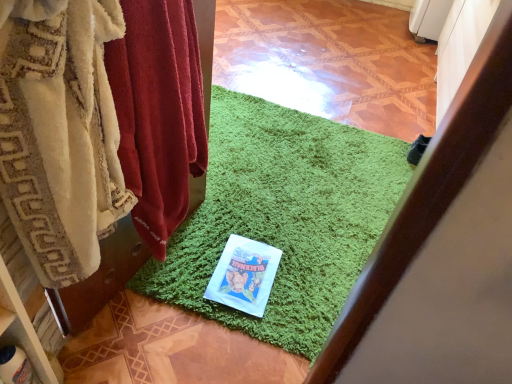
What do you see at coordinates (158, 113) in the screenshot? The width and height of the screenshot is (512, 384). I see `white fluffy towel at left` at bounding box center [158, 113].

Measure the distance between point [188,80] and camera.

Point [188,80] is 3.35 feet from camera.

This screenshot has height=384, width=512. In order to click on white fluffy towel at left in this screenshot , I will do `click(158, 113)`.

At what (x,y) coordinates should I click in order to perform the action: click on white fluffy towel at left. Please return your answer as a coordinate pair (x, y). Looking at the image, I should click on [x=158, y=113].